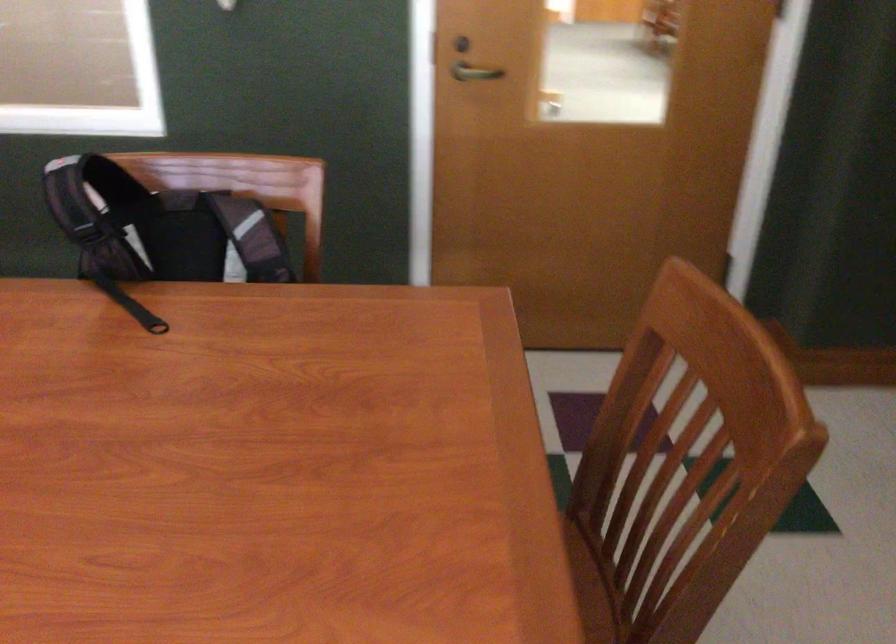
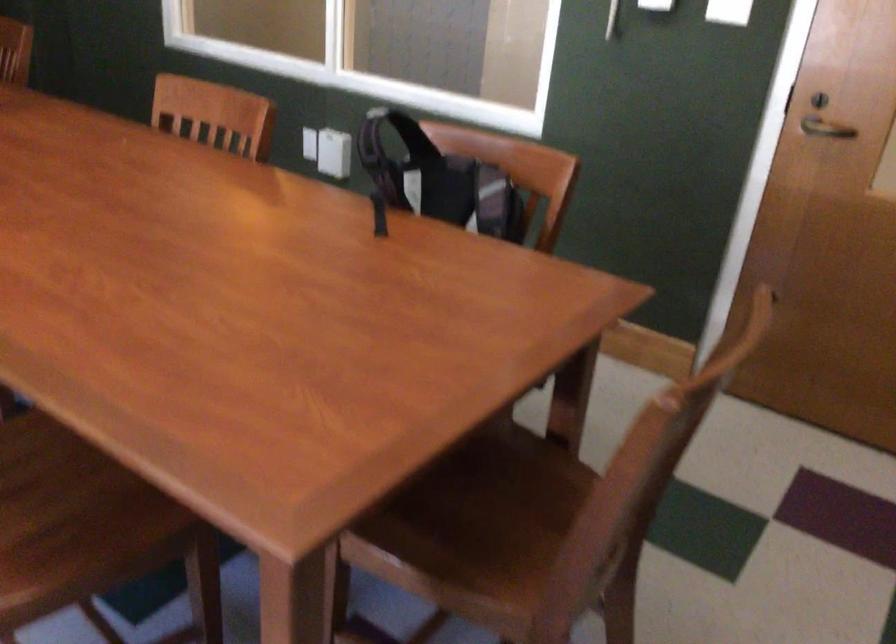
In the second image, find the point that corresponds to (x=485, y=76) in the first image.

(824, 129)